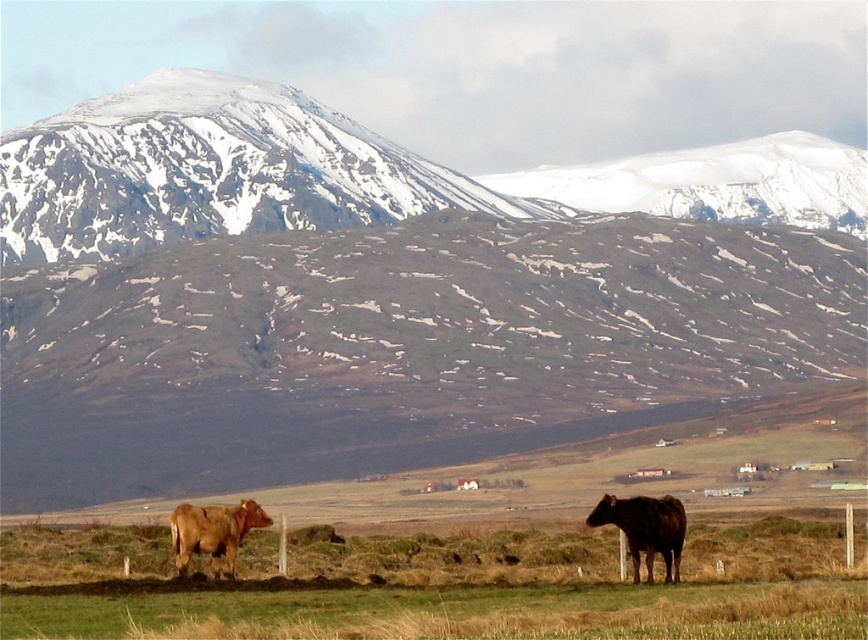
Can you confirm if brown glossy cow at lower right is positioned below brown matte cow at lower left?

Incorrect, brown glossy cow at lower right is not positioned below brown matte cow at lower left.

Can you confirm if brown glossy cow at lower right is shorter than brown matte cow at lower left?

In fact, brown glossy cow at lower right may be taller than brown matte cow at lower left.

Describe the element at coordinates (645, 529) in the screenshot. The image size is (868, 640). I see `brown glossy cow at lower right` at that location.

What are the coordinates of `brown glossy cow at lower right` in the screenshot? It's located at (645, 529).

Is point (231, 186) positioned after point (214, 572)?

Yes, it is.

Consider the image. Does snowy rock mountain at upper left appear over brown matte cow at lower left?

Correct, snowy rock mountain at upper left is located above brown matte cow at lower left.

Find the location of a particular element. snowy rock mountain at upper left is located at coordinates (211, 172).

Where is `snowy rock mountain at upper left`? Image resolution: width=868 pixels, height=640 pixels. snowy rock mountain at upper left is located at coordinates (211, 172).

The width and height of the screenshot is (868, 640). What do you see at coordinates (211, 172) in the screenshot? I see `snowy rock mountain at upper left` at bounding box center [211, 172].

Who is more distant from viewer, (224, 227) or (636, 529)?

The point (224, 227) is more distant.

Where is `snowy rock mountain at upper left`? snowy rock mountain at upper left is located at coordinates (211, 172).